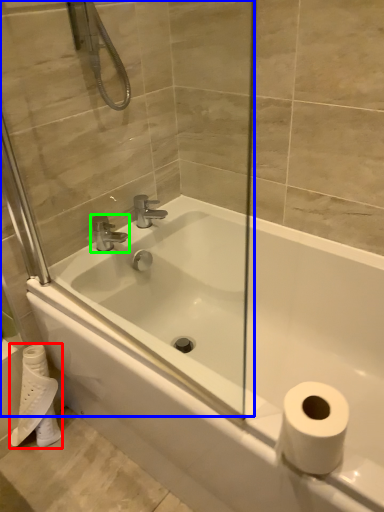
Question: Estimate the real-world distances between objects in this image. Which object is closer to toilet paper (highlighted by a red box), glass door (highlighted by a blue box) or tap (highlighted by a green box)?

Choices:
 (A) glass door
 (B) tap

Answer: (B)